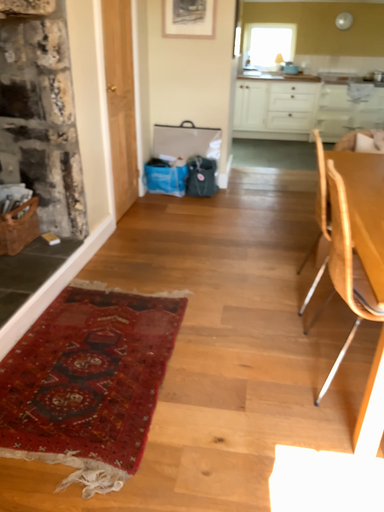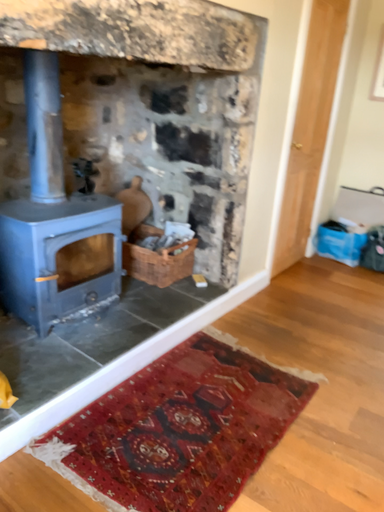
Question: How did the camera likely rotate when shooting the video?

Choices:
 (A) rotated right
 (B) rotated left

Answer: (B)